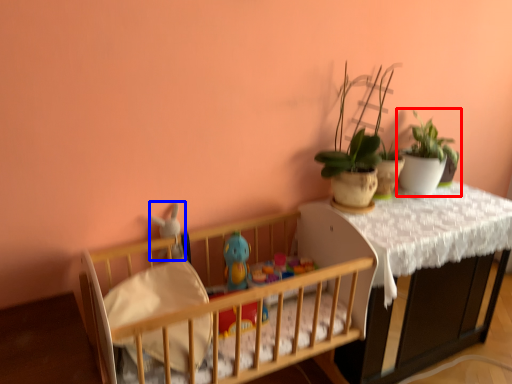
Question: Which object appears farthest to the camera in this image, houseplant (highlighted by a red box) or toy (highlighted by a blue box)?

Choices:
 (A) houseplant
 (B) toy

Answer: (A)